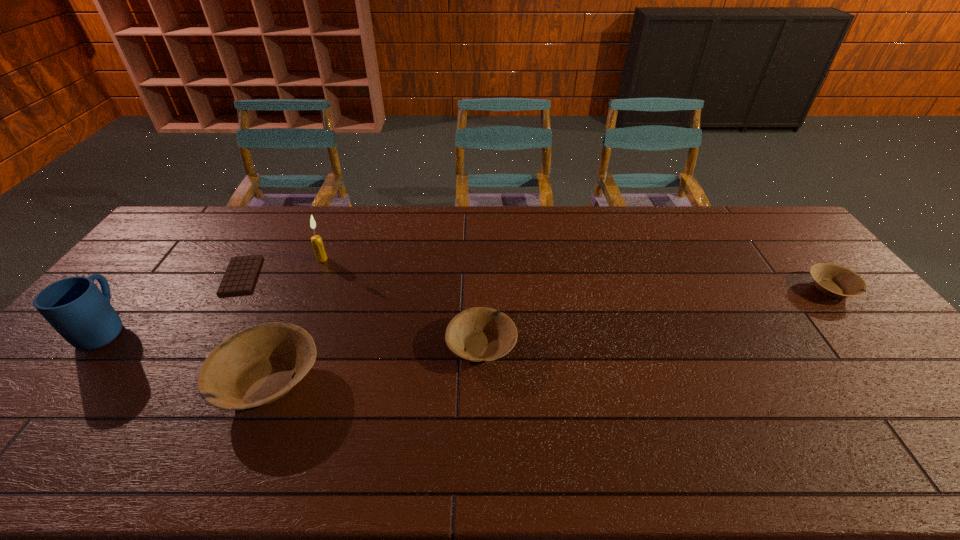
At what (x,y) coordinates should I click in order to perform the action: click on the fourth shortest object. Please return your answer as a coordinate pair (x, y). This screenshot has height=540, width=960. Looking at the image, I should click on (256, 366).

In order to click on the leftmost bowl in this screenshot , I will do `click(256, 366)`.

In order to click on the fifth object from left to right in this screenshot , I will do `click(477, 334)`.

Find the location of a particular element. the fourth tallest object is located at coordinates (477, 334).

Image resolution: width=960 pixels, height=540 pixels. Identify the location of the fifth tallest object. (833, 280).

Where is `the farthest bowl`? Image resolution: width=960 pixels, height=540 pixels. the farthest bowl is located at coordinates (833, 280).

At what (x,y) coordinates should I click in order to perform the action: click on candle. Please return your answer as a coordinate pair (x, y). Image resolution: width=960 pixels, height=540 pixels. Looking at the image, I should click on (317, 243).

Where is `mug`? mug is located at coordinates (75, 307).

At what (x,y) coordinates should I click in order to perform the action: click on the second object from left to right. Please return your answer as a coordinate pair (x, y). Looking at the image, I should click on (240, 274).

You are a GUI agent. You are given a task and a screenshot of the screen. Output one action in this format:
    pyautogui.click(x=<x>, y=<y>)
    Task: Click on the shortest object
    The width and height of the screenshot is (960, 540).
    Given the screenshot: What is the action you would take?
    pyautogui.click(x=240, y=274)